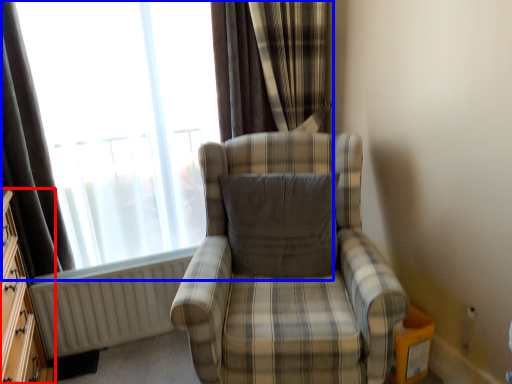
Question: Which object is closer to the camera taking this photo, dresser (highlighted by a red box) or window (highlighted by a blue box)?

Choices:
 (A) dresser
 (B) window

Answer: (A)